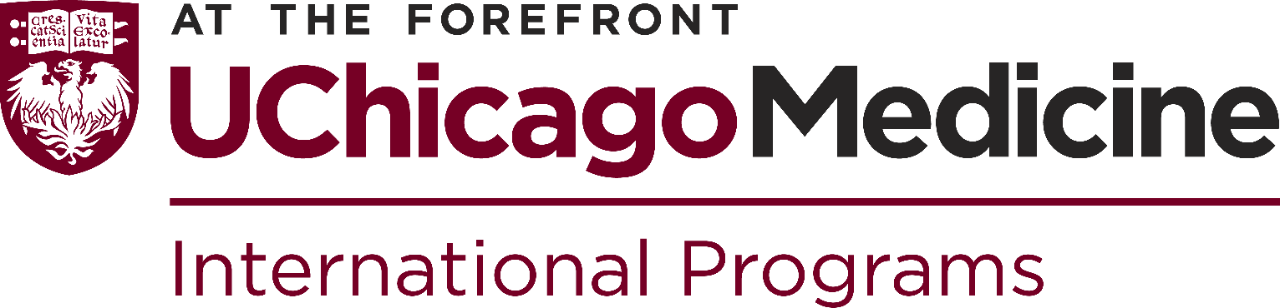
This screenshot has height=308, width=1280. I want to click on book, so click(x=73, y=25).